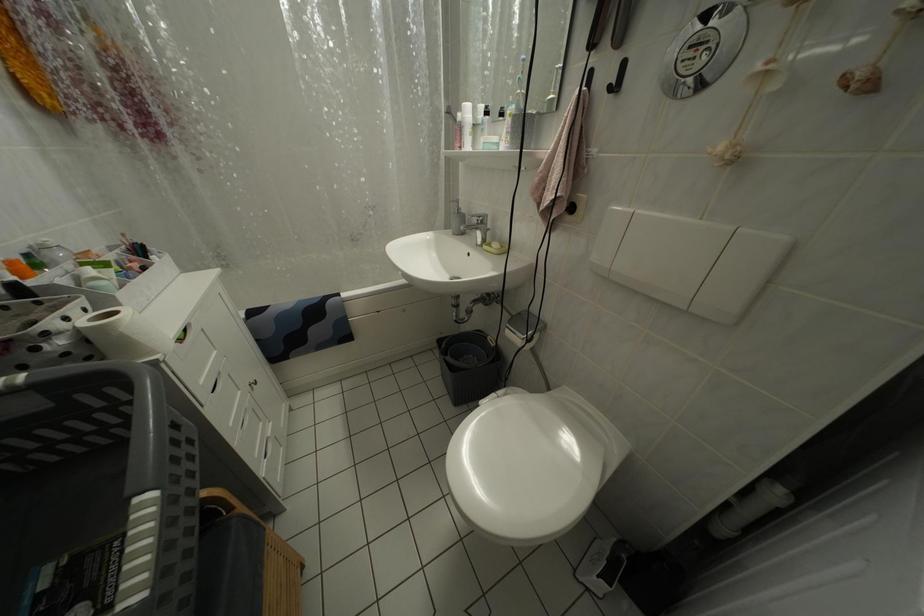
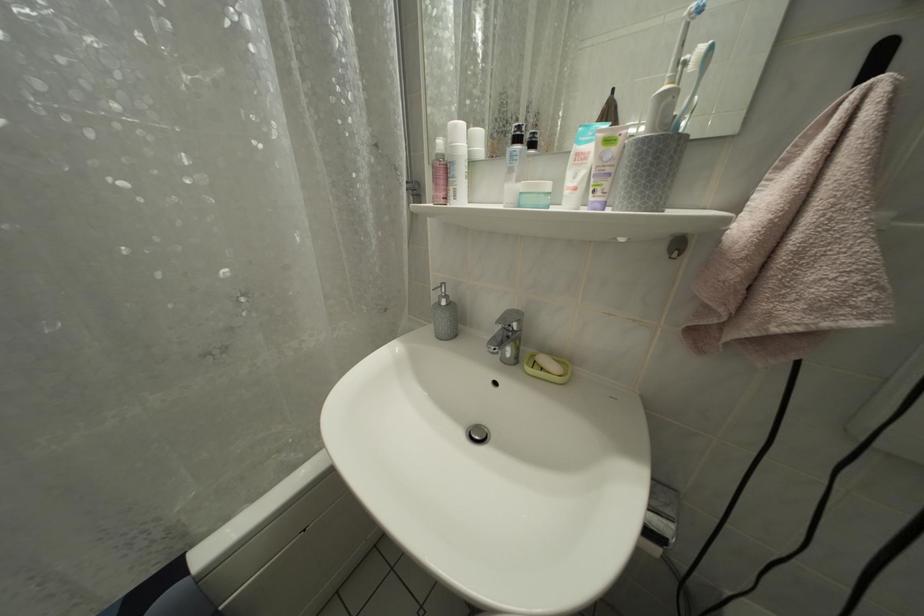
Question: The first image is from the beginning of the video and the second image is from the end. How did the camera likely rotate when shooting the video?

Choices:
 (A) Left
 (B) Right
 (C) Up
 (D) Down

Answer: (B)